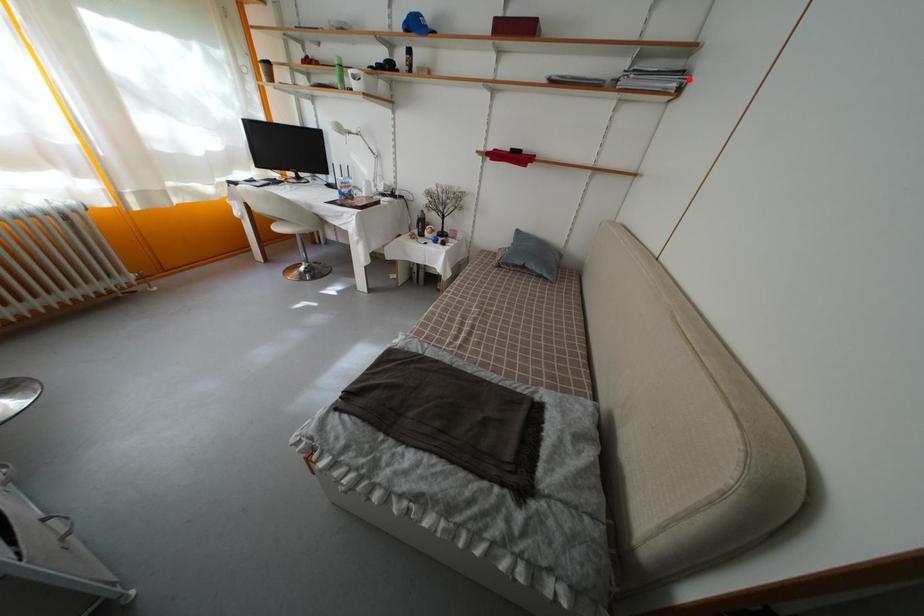
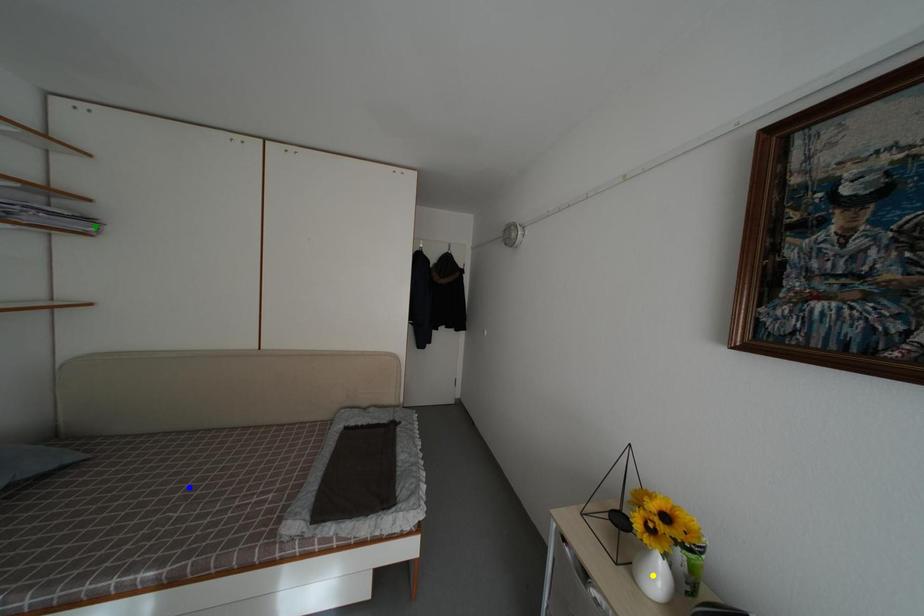
Question: I am providing you with two images of the same scene from different viewpoints. A red point is marked on the first image. You are given multiple points on the second image. Which point in image 2 is actually the same real-world point as the red point in image 1?

Choices:
 (A) blue point
 (B) green point
 (C) yellow point

Answer: (B)